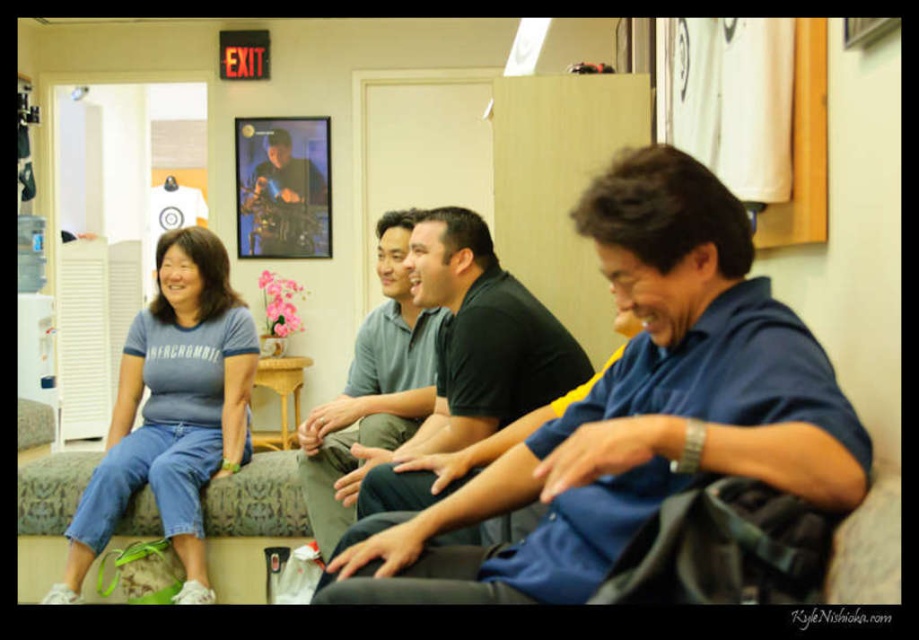
Who is positioned more to the left, blue cotton shirt at center or light blue cotton shirt at center?

From the viewer's perspective, light blue cotton shirt at center appears more on the left side.

Between blue cotton shirt at center and light blue cotton shirt at center, which one appears on the right side from the viewer's perspective?

blue cotton shirt at center is more to the right.

This screenshot has width=919, height=640. What do you see at coordinates (636, 410) in the screenshot? I see `blue cotton shirt at center` at bounding box center [636, 410].

The image size is (919, 640). I want to click on blue cotton shirt at center, so click(x=636, y=410).

Can you confirm if blue cotton shirt at center is bigger than dark green polo shirt at center?

No.

Measure the distance between blue cotton shirt at center and dark green polo shirt at center.

A distance of 24.72 inches exists between blue cotton shirt at center and dark green polo shirt at center.

In order to click on blue cotton shirt at center in this screenshot , I will do `click(636, 410)`.

Looking at this image, is dark green polo shirt at center positioned before denim couch at center?

Yes, it is in front of denim couch at center.

Does point (396, 449) lie in front of point (25, 502)?

Yes, point (396, 449) is closer to viewer.

Is point (473, 248) positioned behind point (240, 483)?

No, (473, 248) is closer to viewer.

Locate an element on the screen. dark green polo shirt at center is located at coordinates (466, 360).